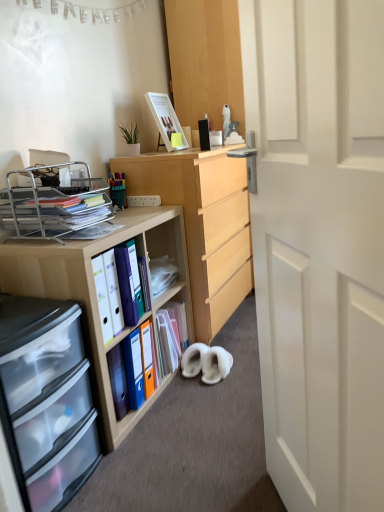
What are the coordinates of `vacant point to the right of green matte plant at upper left` in the screenshot? It's located at (159, 153).